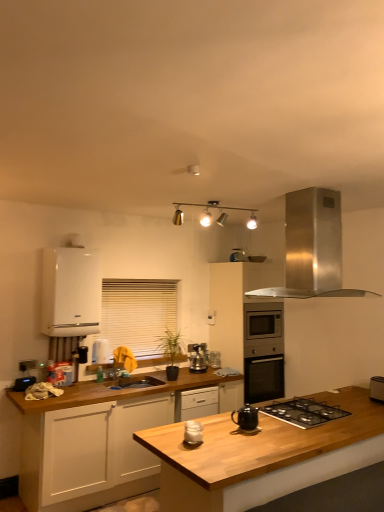
Question: From a real-world perspective, is stainless steel range hood at upper right physically located above or below white matte cabinet at lower left, positioned as the second cabinetry in right-to-left order?

Choices:
 (A) above
 (B) below

Answer: (A)

Question: Would you say stainless steel range hood at upper right is to the left or to the right of white matte cabinet at lower left, positioned as the second cabinetry in right-to-left order, in the picture?

Choices:
 (A) right
 (B) left

Answer: (A)

Question: Which object is the farthest from the wooden at center?

Choices:
 (A) white matte jar at center, which is the first kitchen appliance in front-to-back order
 (B) stainless steel range hood at upper right
 (C) black matte teapot at center, the 2th kitchen appliance viewed from the front
 (D) satin silver toaster at lower right
 (E) metallic track lighting at upper center

Answer: (E)

Question: Which is nearer to the black matte gas stove at center?

Choices:
 (A) white blinds at center
 (B) white matte cabinet at left, the first cabinetry from the left
 (C) stainless steel range hood at upper right
 (D) wooden at center
 (E) white matte cabinet at lower left, positioned as the second cabinetry in right-to-left order

Answer: (D)